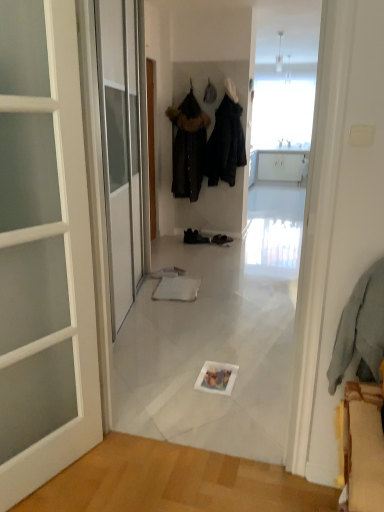
Question: Is black leather shoes at center, which is the first footwear from left to right, with black fabric coat at center, which is counted as the second clothing, starting from the back?

Choices:
 (A) yes
 (B) no

Answer: (B)

Question: From a real-world perspective, is black leather shoes at center, the second footwear when ordered from right to left, physically below black fabric coat at center, which is counted as the second clothing, starting from the back?

Choices:
 (A) no
 (B) yes

Answer: (B)

Question: Is black leather shoes at center, the second footwear when ordered from right to left, positioned with its back to black fabric coat at center, which is counted as the second clothing, starting from the back?

Choices:
 (A) yes
 (B) no

Answer: (B)

Question: Is black leather shoes at center, which is the first footwear from left to right, not inside black fabric coat at center, which is counted as the second clothing, starting from the back?

Choices:
 (A) no
 (B) yes

Answer: (B)

Question: Does black leather shoes at center, the second footwear when ordered from right to left, have a lesser width compared to black fabric coat at center, which is counted as the second clothing, starting from the back?

Choices:
 (A) yes
 (B) no

Answer: (A)

Question: Considering the relative positions of black leather shoes at center, the second footwear when ordered from right to left, and black fabric coat at center, arranged as the second clothing when viewed from the front, in the image provided, is black leather shoes at center, the second footwear when ordered from right to left, to the right of black fabric coat at center, arranged as the second clothing when viewed from the front, from the viewer's perspective?

Choices:
 (A) no
 (B) yes

Answer: (A)

Question: Could you tell me if black fabric coat at center, which is counted as the second clothing, starting from the back, is turned towards black leather shoes at center, the second footwear when ordered from right to left?

Choices:
 (A) yes
 (B) no

Answer: (B)

Question: From the image's perspective, would you say black fabric coat at center, arranged as the second clothing when viewed from the front, is shown under black leather shoes at center, which is the first footwear from left to right?

Choices:
 (A) no
 (B) yes

Answer: (A)

Question: Is black fabric coat at center, which is counted as the second clothing, starting from the back, positioned far away from black leather shoes at center, the second footwear when ordered from right to left?

Choices:
 (A) no
 (B) yes

Answer: (B)

Question: Does black fabric coat at center, arranged as the second clothing when viewed from the front, have a lesser width compared to black leather shoes at center, the second footwear when ordered from right to left?

Choices:
 (A) yes
 (B) no

Answer: (B)

Question: From a real-world perspective, is black fabric coat at center, which is counted as the second clothing, starting from the back, located higher than black leather shoes at center, the second footwear when ordered from right to left?

Choices:
 (A) no
 (B) yes

Answer: (B)

Question: Is black fabric coat at center, arranged as the second clothing when viewed from the front, positioned before black leather shoes at center, which is the first footwear from left to right?

Choices:
 (A) no
 (B) yes

Answer: (B)

Question: Is black fabric coat at center, which is counted as the second clothing, starting from the back, to the left of dark brown fur-trimmed coat at center, the 1th clothing positioned from the back, from the viewer's perspective?

Choices:
 (A) no
 (B) yes

Answer: (A)